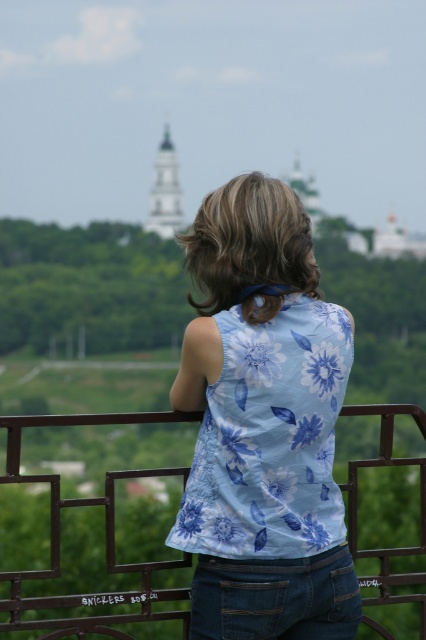
Question: Can you confirm if denim at center is smaller than white steeple at upper center?

Choices:
 (A) yes
 (B) no

Answer: (A)

Question: Among these objects, which one is nearest to the camera?

Choices:
 (A) light blue floral tank top at center
 (B) denim at center
 (C) metallic brown railing at center

Answer: (B)

Question: Can you confirm if light blue floral tank top at center is positioned below metallic brown railing at center?

Choices:
 (A) no
 (B) yes

Answer: (A)

Question: Among these points, which one is nearest to the camera?

Choices:
 (A) (285, 524)
 (B) (52, 508)

Answer: (A)

Question: Which point is closer to the camera taking this photo?

Choices:
 (A) (377, 627)
 (B) (158, 180)
 (C) (221, 564)

Answer: (C)

Question: Does light blue floral tank top at center have a smaller size compared to metallic brown railing at center?

Choices:
 (A) yes
 (B) no

Answer: (A)